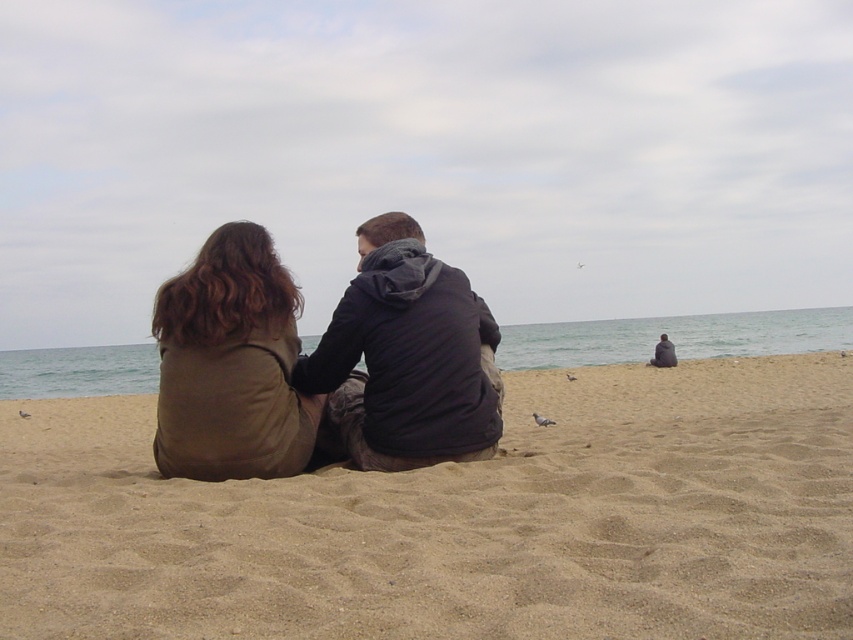
Question: Which point is closer to the camera?

Choices:
 (A) brown feathered pigeon at lower left
 (B) matte brown coat at center

Answer: (B)

Question: Is brown feathered pigeon at lower center wider than brown feathered pigeon at lower left?

Choices:
 (A) no
 (B) yes

Answer: (A)

Question: Can you confirm if matte brown coat at center is positioned to the right of dark gray hoodie at lower right?

Choices:
 (A) yes
 (B) no

Answer: (B)

Question: Which of the following is the farthest from the observer?

Choices:
 (A) (657, 349)
 (B) (672, 422)
 (C) (413, 301)

Answer: (A)

Question: Which point is closer to the camera taking this photo?

Choices:
 (A) (578, 532)
 (B) (566, 372)
 (C) (265, 356)
 (D) (25, 413)

Answer: (A)

Question: Is beige sandy beach at center wider than brown feathered pigeon at lower left?

Choices:
 (A) yes
 (B) no

Answer: (A)